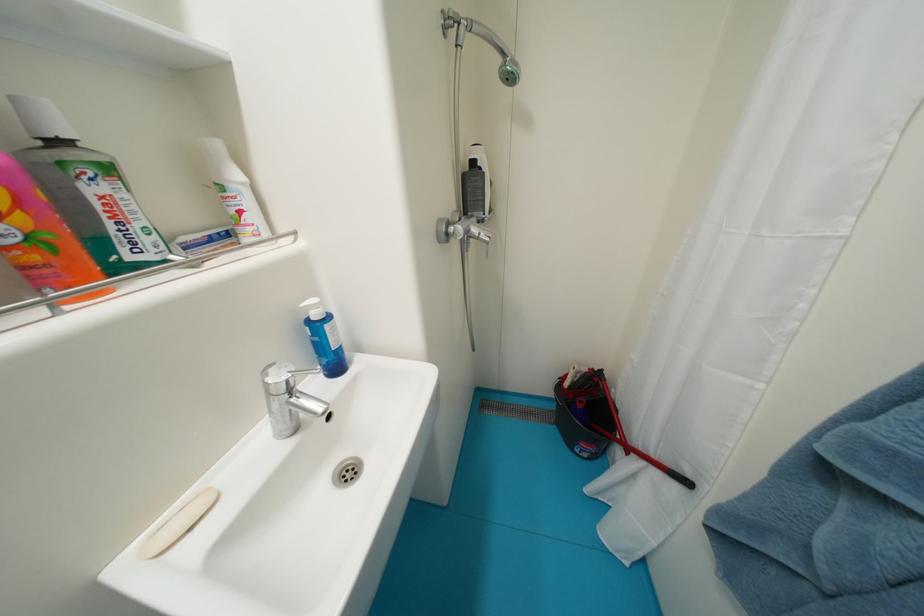
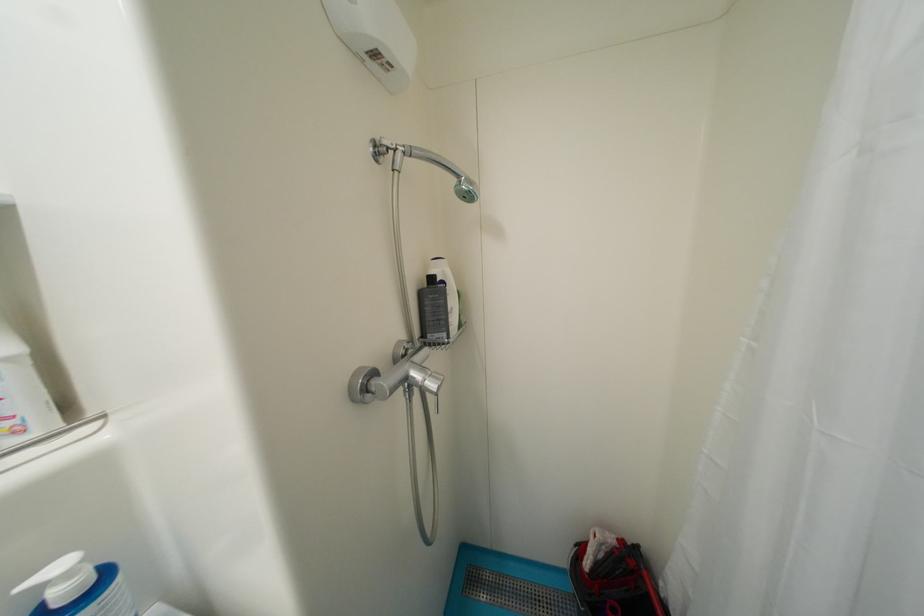
Where in the second image is the point corresponding to (323,308) from the first image?

(75, 576)